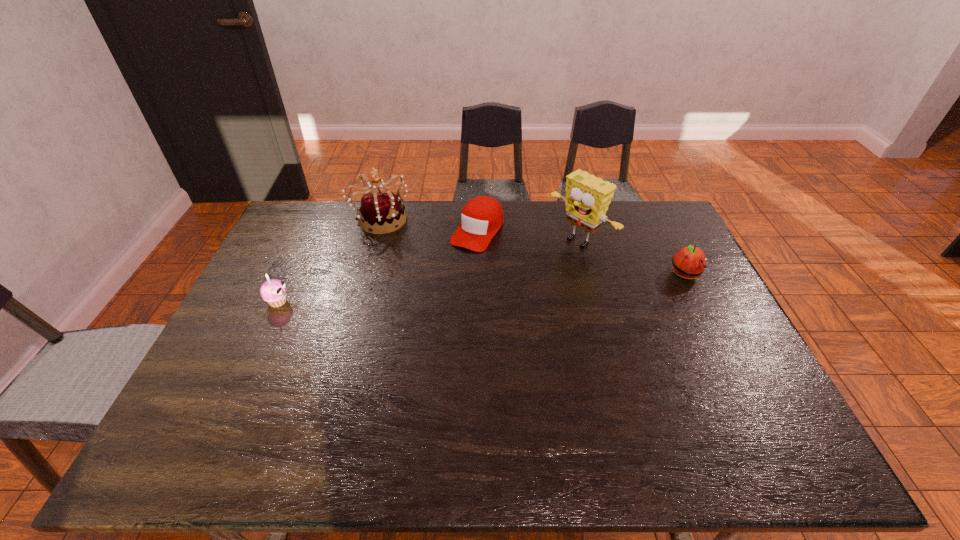
Find the location of `vacant area that lies between the apple and the third object from right to left`. vacant area that lies between the apple and the third object from right to left is located at coordinates (581, 253).

Identify the location of free space between the sponge and the cupcake. This screenshot has width=960, height=540. [429, 271].

You are a GUI agent. You are given a task and a screenshot of the screen. Output one action in this format:
    pyautogui.click(x=<x>, y=<y>)
    Task: Click on the unoccupied area between the nearest object and the sponge
    
    Given the screenshot: What is the action you would take?
    pyautogui.click(x=429, y=271)

Locate an element on the screen. Image resolution: width=960 pixels, height=540 pixels. vacant area that lies between the sponge and the cupcake is located at coordinates (429, 271).

What are the coordinates of `unoccupied position between the baseball cap and the fourth farthest object` in the screenshot? It's located at (581, 253).

I want to click on unoccupied position between the baseball cap and the rightmost object, so click(581, 253).

The height and width of the screenshot is (540, 960). What are the coordinates of `empty space between the fourth farthest object and the third object from right to left` in the screenshot? It's located at (581, 253).

At what (x,y) coordinates should I click in order to perform the action: click on empty space between the fourth object from left to right and the rightmost object. Please return your answer as a coordinate pair (x, y). The width and height of the screenshot is (960, 540). Looking at the image, I should click on (633, 258).

At what (x,y) coordinates should I click in order to perform the action: click on object that stands as the second closest to the nearest object. Please return your answer as a coordinate pair (x, y). The height and width of the screenshot is (540, 960). Looking at the image, I should click on (482, 217).

Find the location of a particular element. The width and height of the screenshot is (960, 540). object that stands as the third closest to the nearest object is located at coordinates (587, 199).